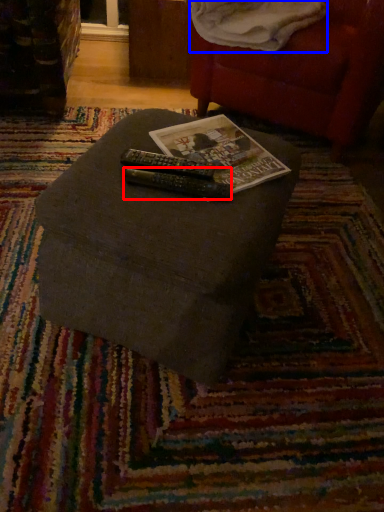
Question: Among these objects, which one is farthest to the camera, remote (highlighted by a red box) or blanket (highlighted by a blue box)?

Choices:
 (A) remote
 (B) blanket

Answer: (B)